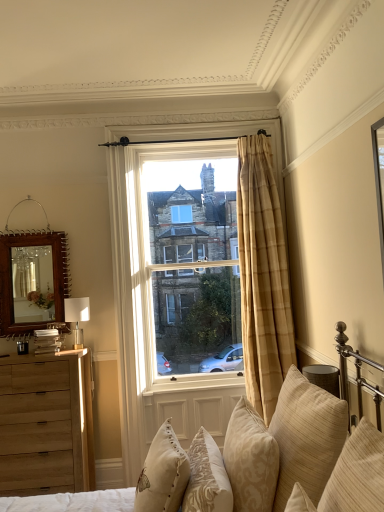
Identify the location of beige fabric cushions at lower right. (275, 460).

The image size is (384, 512). Describe the element at coordinates (262, 277) in the screenshot. I see `plaid fabric curtain at center` at that location.

How much space does beige striped pillow at lower right, which ranks as the fifth pillow in left-to-right order, occupy horizontally?

The width of beige striped pillow at lower right, which ranks as the fifth pillow in left-to-right order, is 13.73 inches.

The width and height of the screenshot is (384, 512). In order to click on beige striped pillow at lower right, which ranks as the fifth pillow in left-to-right order in this screenshot , I will do `click(357, 473)`.

Measure the distance between clear glass window at center, positioned as the second window in front-to-back order, and camera.

The distance of clear glass window at center, positioned as the second window in front-to-back order, from camera is 11.38 feet.

The image size is (384, 512). Describe the element at coordinates (77, 317) in the screenshot. I see `white fabric lampshade at left` at that location.

This screenshot has height=512, width=384. What do you see at coordinates (152, 316) in the screenshot?
I see `plaid curtain at center, the second window in the back-to-front sequence` at bounding box center [152, 316].

The width and height of the screenshot is (384, 512). Identify the location of wooden mirror at left. (32, 281).

From the image's perspective, is plaid fabric curtain at center located above or below velvet beige pillow at lower center, which is the 4th pillow from right to left?

plaid fabric curtain at center is situated higher than velvet beige pillow at lower center, which is the 4th pillow from right to left, in the image.

Can you confirm if plaid fabric curtain at center is bigger than velvet beige pillow at lower center, which is counted as the 2th pillow, starting from the left?

Yes, plaid fabric curtain at center is bigger than velvet beige pillow at lower center, which is counted as the 2th pillow, starting from the left.

Is plaid fabric curtain at center not near velvet beige pillow at lower center, which is counted as the 2th pillow, starting from the left?

plaid fabric curtain at center is far away from velvet beige pillow at lower center, which is counted as the 2th pillow, starting from the left.

From a real-world perspective, is plaid fabric curtain at center positioned under velvet beige pillow at lower center, which is counted as the 2th pillow, starting from the left, based on gravity?

Actually, plaid fabric curtain at center is physically above velvet beige pillow at lower center, which is counted as the 2th pillow, starting from the left, in the real world.

Considering the sizes of objects beige damask pillow at lower center, arranged as the third pillow when viewed from the right, and natural wood dresser at left in the image provided, who is thinner, beige damask pillow at lower center, arranged as the third pillow when viewed from the right, or natural wood dresser at left?

With smaller width is beige damask pillow at lower center, arranged as the third pillow when viewed from the right.

Which is in front, beige damask pillow at lower center, the third pillow when ordered from left to right, or natural wood dresser at left?

beige damask pillow at lower center, the third pillow when ordered from left to right, is in front.

Visually, is beige damask pillow at lower center, arranged as the third pillow when viewed from the right, positioned to the left or to the right of natural wood dresser at left?

In the image, beige damask pillow at lower center, arranged as the third pillow when viewed from the right, appears on the right side of natural wood dresser at left.

Would you say beige damask pillow at lower center, arranged as the third pillow when viewed from the right, is inside or outside natural wood dresser at left?

beige damask pillow at lower center, arranged as the third pillow when viewed from the right, is located beyond the bounds of natural wood dresser at left.

Does clear glass window at center, which is counted as the first window, starting from the back, touch beige damask pillow at lower center, arranged as the third pillow when viewed from the right?

No.

Would you say clear glass window at center, which is counted as the first window, starting from the back, contains beige damask pillow at lower center, the third pillow when ordered from left to right?

No, beige damask pillow at lower center, the third pillow when ordered from left to right, is not inside clear glass window at center, which is counted as the first window, starting from the back.

Considering the sizes of objects clear glass window at center, positioned as the second window in front-to-back order, and beige damask pillow at lower center, the third pillow when ordered from left to right, in the image provided, who is thinner, clear glass window at center, positioned as the second window in front-to-back order, or beige damask pillow at lower center, the third pillow when ordered from left to right,?

clear glass window at center, positioned as the second window in front-to-back order, is thinner.

From the image's perspective, is clear glass window at center, positioned as the second window in front-to-back order, over beige damask pillow at lower center, arranged as the third pillow when viewed from the right?

Indeed, from the image's perspective, clear glass window at center, positioned as the second window in front-to-back order, is shown above beige damask pillow at lower center, arranged as the third pillow when viewed from the right.

Consider the image. Is beige textured pillow at lower right, the second pillow positioned from the right, directly adjacent to velvet beige pillow at lower center, which is the 4th pillow from right to left?

No, beige textured pillow at lower right, the second pillow positioned from the right, is not in contact with velvet beige pillow at lower center, which is the 4th pillow from right to left.

From a real-world perspective, count 3rd pillows downward from the beige textured pillow at lower right, the second pillow positioned from the right, and point to it. Please provide its 2D coordinates.

[(207, 477)]

Is beige textured pillow at lower right, positioned as the fourth pillow in left-to-right order, wider than velvet beige pillow at lower center, which is counted as the 2th pillow, starting from the left?

Yes, beige textured pillow at lower right, positioned as the fourth pillow in left-to-right order, is wider than velvet beige pillow at lower center, which is counted as the 2th pillow, starting from the left.

From a real-world perspective, relative to velvet beige pillow at lower center, which is counted as the 2th pillow, starting from the left, is beige textured pillow at lower right, the second pillow positioned from the right, vertically above or below?

beige textured pillow at lower right, the second pillow positioned from the right, is situated higher than velvet beige pillow at lower center, which is counted as the 2th pillow, starting from the left, in the real world.

Is beige striped pillow at lower right, which ranks as the fifth pillow in left-to-right order, oriented away from beige textured pillow at lower right, positioned as the fourth pillow in left-to-right order?

No, beige striped pillow at lower right, which ranks as the fifth pillow in left-to-right order, is not facing the opposite direction of beige textured pillow at lower right, positioned as the fourth pillow in left-to-right order.

From a real-world perspective, who is located lower, beige striped pillow at lower right, the 1th pillow positioned from the right, or beige textured pillow at lower right, positioned as the fourth pillow in left-to-right order?

beige textured pillow at lower right, positioned as the fourth pillow in left-to-right order.

Can you confirm if beige striped pillow at lower right, the 1th pillow positioned from the right, is positioned to the left of beige textured pillow at lower right, positioned as the fourth pillow in left-to-right order?

Incorrect, beige striped pillow at lower right, the 1th pillow positioned from the right, is not on the left side of beige textured pillow at lower right, positioned as the fourth pillow in left-to-right order.

Between beige striped pillow at lower right, which ranks as the fifth pillow in left-to-right order, and beige textured pillow at lower right, positioned as the fourth pillow in left-to-right order, which one has more height?

beige textured pillow at lower right, positioned as the fourth pillow in left-to-right order.

Is natural wood dresser at left a part of plaid curtain at center, which appears as the 1th window when viewed from the front?

No, natural wood dresser at left is not surrounded by plaid curtain at center, which appears as the 1th window when viewed from the front.

There is a natural wood dresser at left. Identify the location of the 1st window above it (from the image's perspective). This screenshot has width=384, height=512. (152, 316).

Considering the sizes of plaid curtain at center, the second window in the back-to-front sequence, and natural wood dresser at left in the image, is plaid curtain at center, the second window in the back-to-front sequence, taller or shorter than natural wood dresser at left?

In the image, plaid curtain at center, the second window in the back-to-front sequence, appears to be taller than natural wood dresser at left.

Is clear glass window at center, which is counted as the first window, starting from the back, located outside beige striped pillow at lower right, the 1th pillow positioned from the right?

Absolutely, clear glass window at center, which is counted as the first window, starting from the back, is external to beige striped pillow at lower right, the 1th pillow positioned from the right.

From the image's perspective, which one is positioned higher, clear glass window at center, which is counted as the first window, starting from the back, or beige striped pillow at lower right, which ranks as the fifth pillow in left-to-right order?

clear glass window at center, which is counted as the first window, starting from the back, from the image's perspective.

Is clear glass window at center, positioned as the second window in front-to-back order, at the right side of beige striped pillow at lower right, the 1th pillow positioned from the right?

No.

From the picture: Is clear glass window at center, which is counted as the first window, starting from the back, aimed at beige striped pillow at lower right, the 1th pillow positioned from the right?

Yes.

Locate an element on the screen. curtain above the velvet beige pillow at lower center, which is the 4th pillow from right to left (from a real-world perspective) is located at coordinates (x=262, y=277).

From the natural wood dresser at left, count 3rd pillow to the right and point to it. Please provide its 2D coordinates.

[(250, 460)]

From the image, which object appears to be farther from white fabric lampshade at left, beige fabric cushions at lower right or beige textured pillow at lower right, positioned as the fourth pillow in left-to-right order?

beige textured pillow at lower right, positioned as the fourth pillow in left-to-right order.

Which object lies further to the anchor point plaid fabric curtain at center, beige striped pillow at lower right, which ranks as the fifth pillow in left-to-right order, or clear glass window at center, positioned as the second window in front-to-back order?

Based on the image, beige striped pillow at lower right, which ranks as the fifth pillow in left-to-right order, appears to be further to plaid fabric curtain at center.

When comparing their distances from natural wood dresser at left, does plaid fabric curtain at center or beige striped pillow at lower right, the 1th pillow positioned from the right, seem closer?

plaid fabric curtain at center is positioned closer to the anchor natural wood dresser at left.

Considering their positions, is plaid curtain at center, the second window in the back-to-front sequence, positioned closer to beige embroidered pillow at lower center, acting as the first pillow starting from the left, than white fabric lampshade at left?

Among the two, white fabric lampshade at left is located nearer to beige embroidered pillow at lower center, acting as the first pillow starting from the left.

Considering their positions, is beige fabric cushions at lower right positioned further to white fabric lampshade at left than natural wood dresser at left?

beige fabric cushions at lower right is positioned further to the anchor white fabric lampshade at left.

Based on their spatial positions, is white fabric lampshade at left or natural wood dresser at left further from beige embroidered pillow at lower center, acting as the first pillow starting from the left?

Based on the image, white fabric lampshade at left appears to be further to beige embroidered pillow at lower center, acting as the first pillow starting from the left.

Estimate the real-world distances between objects in this image. Which object is closer to natural wood dresser at left, beige striped pillow at lower right, the 1th pillow positioned from the right, or beige fabric cushions at lower right?

Based on the image, beige fabric cushions at lower right appears to be nearer to natural wood dresser at left.

In the scene shown: Considering their positions, is velvet beige pillow at lower center, which is counted as the 2th pillow, starting from the left, positioned closer to wooden mirror at left than beige striped pillow at lower right, which ranks as the fifth pillow in left-to-right order?

Based on the image, velvet beige pillow at lower center, which is counted as the 2th pillow, starting from the left, appears to be nearer to wooden mirror at left.

Find the location of a particular element. table lamp between beige damask pillow at lower center, arranged as the third pillow when viewed from the right, and wooden mirror at left, along the z-axis is located at coordinates (77, 317).

Identify the location of table lamp between natural wood dresser at left and plaid fabric curtain at center. The height and width of the screenshot is (512, 384). (77, 317).

This screenshot has height=512, width=384. Find the location of `window between plaid fabric curtain at center and clear glass window at center, positioned as the second window in front-to-back order, in the front-back direction`. window between plaid fabric curtain at center and clear glass window at center, positioned as the second window in front-to-back order, in the front-back direction is located at coordinates (152, 316).

Identify the location of window between natural wood dresser at left and plaid curtain at center, which appears as the 1th window when viewed from the front. Image resolution: width=384 pixels, height=512 pixels. (194, 265).